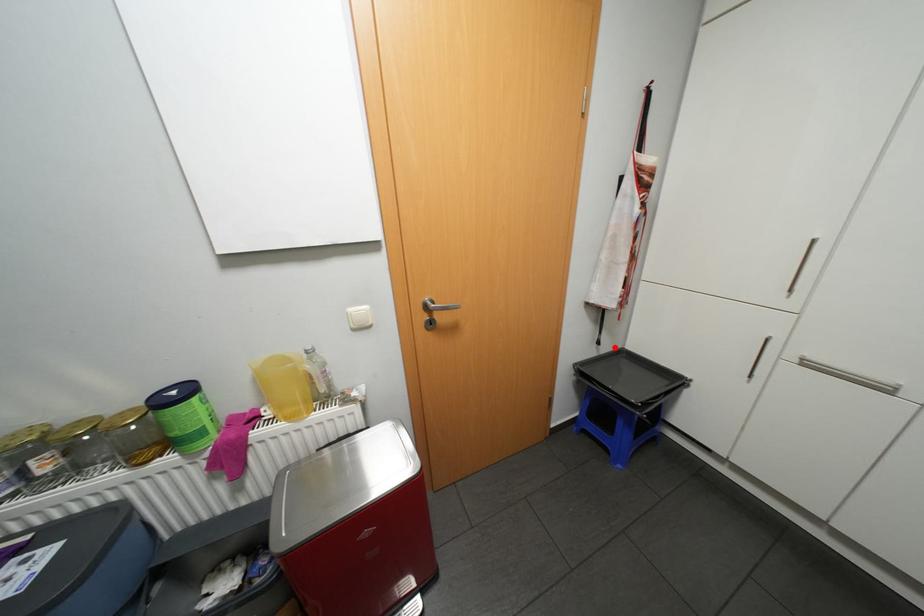
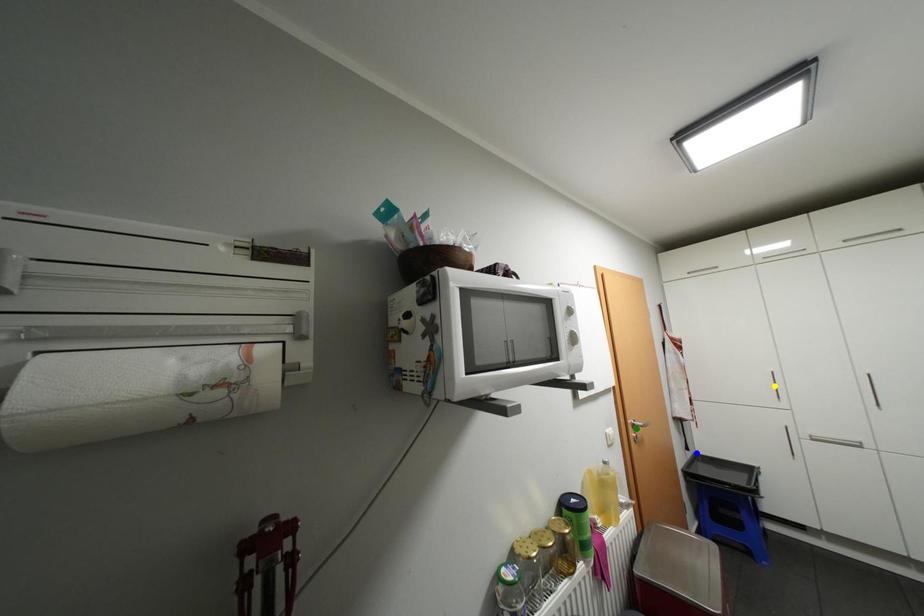
Question: I am providing you with two images of the same scene from different viewpoints. A red point is marked on the first image. You are given multiple points on the second image. Can you choose the point in image 2 that corresponds to the point in image 1?

Choices:
 (A) yellow point
 (B) green point
 (C) blue point

Answer: (C)